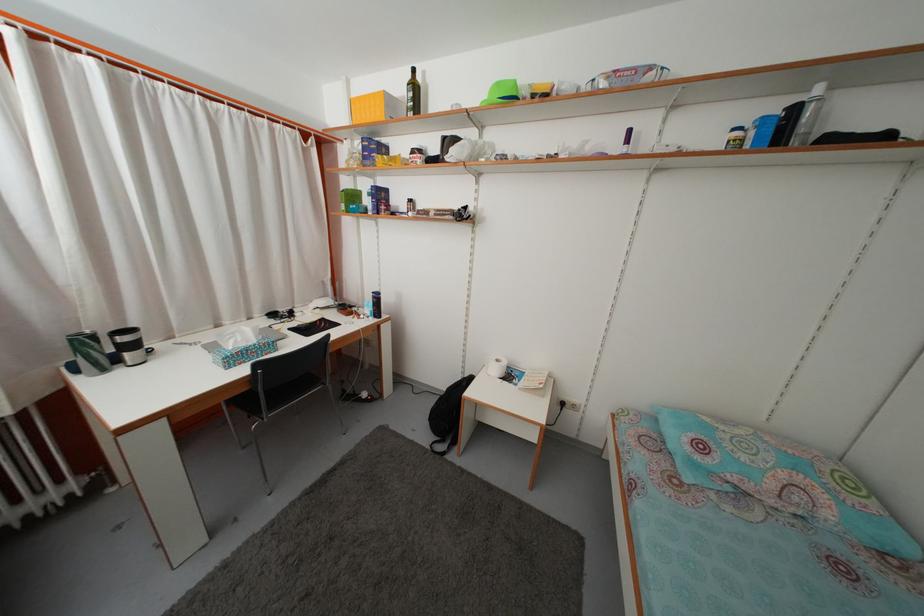
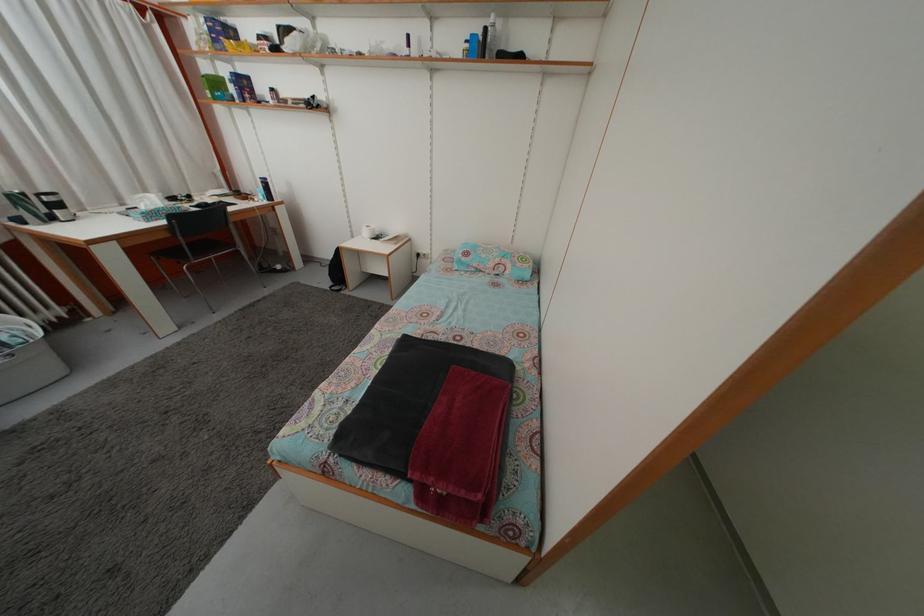
Find the pixel in the second image that matches pixel 224 333 in the first image.

(128, 213)